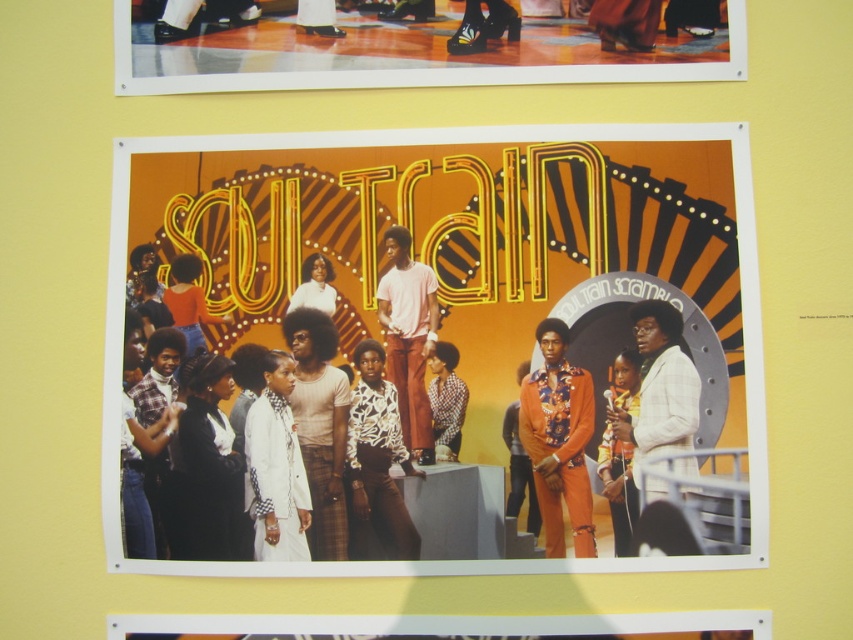
Question: Based on their relative distances, which object is nearer to the orange matte shirt at center?

Choices:
 (A) white matte jacket at center
 (B) floral print suit at center

Answer: (A)

Question: Which object appears farthest from the camera in this image?

Choices:
 (A) floral print pantsuit at center-right
 (B) shiny metallic shoes at upper center

Answer: (B)

Question: Estimate the real-world distances between objects in this image. Which object is closer to the plaid shirt at center?

Choices:
 (A) black satin dress at lower left
 (B) orange matte shirt at center

Answer: (A)

Question: Is shiny metallic shoes at upper center bigger than floral print suit at center?

Choices:
 (A) no
 (B) yes

Answer: (B)

Question: Does white printed shirt at center appear on the left side of white matte suit at right?

Choices:
 (A) no
 (B) yes

Answer: (B)

Question: Does white printed shirt at center appear over floral print pantsuit at center-right?

Choices:
 (A) yes
 (B) no

Answer: (A)